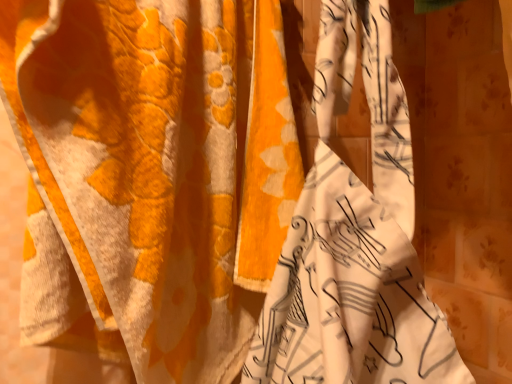
Question: Should I look upward or downward to see orange fabric curtain at center, placed as the second curtain when sorted from right to left?

Choices:
 (A) down
 (B) up

Answer: (A)

Question: Does orange fabric curtain at center, placed as the second curtain when sorted from right to left, contain floral fabric curtain at center, which is the 2th curtain from left to right?

Choices:
 (A) no
 (B) yes

Answer: (A)

Question: Is orange fabric curtain at center, placed as the second curtain when sorted from right to left, completely or partially outside of floral fabric curtain at center, which is the first curtain from right to left?

Choices:
 (A) no
 (B) yes

Answer: (B)

Question: Is orange fabric curtain at center, acting as the first curtain starting from the left, bigger than floral fabric curtain at center, which is the 2th curtain from left to right?

Choices:
 (A) yes
 (B) no

Answer: (A)

Question: Is the depth of orange fabric curtain at center, placed as the second curtain when sorted from right to left, greater than that of floral fabric curtain at center, which is the 2th curtain from left to right?

Choices:
 (A) yes
 (B) no

Answer: (A)

Question: Is orange fabric curtain at center, placed as the second curtain when sorted from right to left, at the left side of floral fabric curtain at center, which is the 2th curtain from left to right?

Choices:
 (A) no
 (B) yes

Answer: (B)

Question: Is orange fabric curtain at center, acting as the first curtain starting from the left, oriented towards floral fabric curtain at center, which is the first curtain from right to left?

Choices:
 (A) yes
 (B) no

Answer: (A)

Question: Is floral fabric curtain at center, which is the first curtain from right to left, directly adjacent to orange fabric curtain at center, placed as the second curtain when sorted from right to left?

Choices:
 (A) yes
 (B) no

Answer: (B)

Question: Would you say floral fabric curtain at center, which is the first curtain from right to left, contains orange fabric curtain at center, placed as the second curtain when sorted from right to left?

Choices:
 (A) yes
 (B) no

Answer: (B)

Question: Can you confirm if floral fabric curtain at center, which is the first curtain from right to left, is wider than orange fabric curtain at center, placed as the second curtain when sorted from right to left?

Choices:
 (A) yes
 (B) no

Answer: (A)

Question: Considering the relative sizes of floral fabric curtain at center, which is the first curtain from right to left, and orange fabric curtain at center, acting as the first curtain starting from the left, in the image provided, is floral fabric curtain at center, which is the first curtain from right to left, shorter than orange fabric curtain at center, acting as the first curtain starting from the left,?

Choices:
 (A) no
 (B) yes

Answer: (B)

Question: Is floral fabric curtain at center, which is the 2th curtain from left to right, further to camera compared to orange fabric curtain at center, acting as the first curtain starting from the left?

Choices:
 (A) no
 (B) yes

Answer: (A)

Question: Is floral fabric curtain at center, which is the first curtain from right to left, at the right side of orange fabric curtain at center, placed as the second curtain when sorted from right to left?

Choices:
 (A) yes
 (B) no

Answer: (A)

Question: From their relative heights in the image, would you say floral fabric curtain at center, which is the 2th curtain from left to right, is taller or shorter than orange fabric curtain at center, placed as the second curtain when sorted from right to left?

Choices:
 (A) tall
 (B) short

Answer: (B)